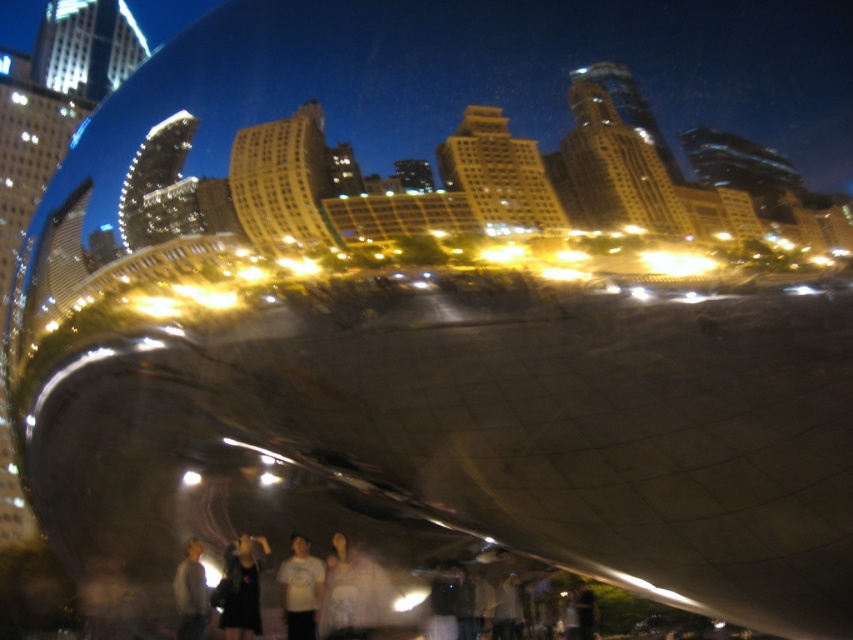
From the picture: You are standing in front of the reflective metallic sculpture and want to locate the dark gray fabric at lower center. Where exactly is it positioned relative to the sculpture?

The dark gray fabric at lower center is located at point 0.920 on the x axis and 0.283 on the y axis relative to the sculpture.

You are an artist trying to sketch the scene. You notice two gray fabrics in the image. The first is the dark gray fabric at lower center, and the second is the gray fabric shirt at lower left. Which of these two fabrics is narrower in width?

The dark gray fabric at lower center is narrower in width than the gray fabric shirt at lower left.